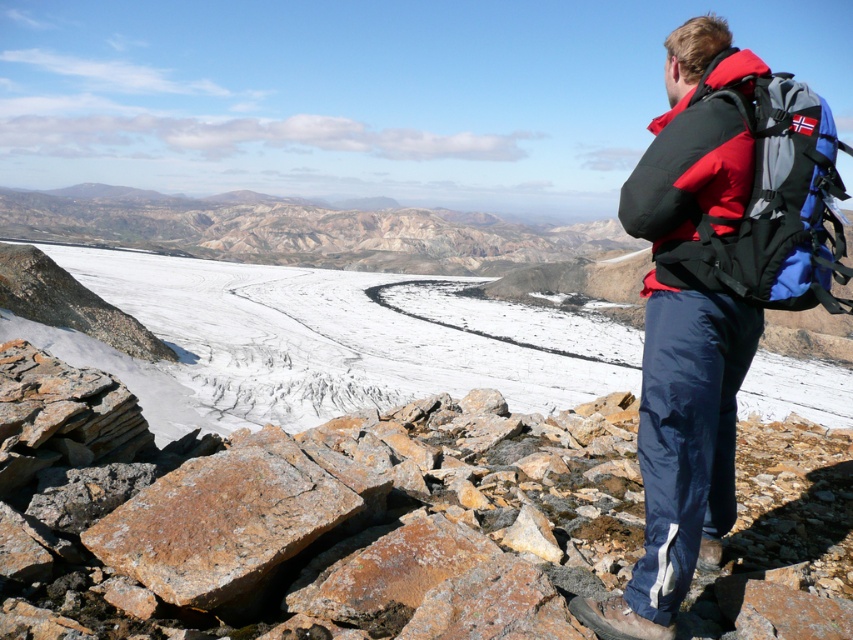
Measure the distance between rusty rock at lower left and camera.

They are 4.25 meters apart.

Is rusty rock at lower left shorter than matte black jacket at center?

Yes.

Is point (283, 561) farther from viewer compared to point (737, 188)?

Yes, it is.

The height and width of the screenshot is (640, 853). Find the location of `rusty rock at lower left`. rusty rock at lower left is located at coordinates (310, 520).

From the picture: Does rusty rock at lower left appear on the right side of blue fabric backpack at right?

In fact, rusty rock at lower left is to the left of blue fabric backpack at right.

At what (x,y) coordinates should I click in order to perform the action: click on rusty rock at lower left. Please return your answer as a coordinate pair (x, y). This screenshot has width=853, height=640. Looking at the image, I should click on 310,520.

This screenshot has height=640, width=853. What do you see at coordinates (310, 520) in the screenshot?
I see `rusty rock at lower left` at bounding box center [310, 520].

The image size is (853, 640). What are the coordinates of `rusty rock at lower left` in the screenshot? It's located at (310, 520).

Is matte black jacket at center shorter than blue fabric backpack at right?

No, matte black jacket at center is not shorter than blue fabric backpack at right.

Can you confirm if matte black jacket at center is smaller than blue fabric backpack at right?

Indeed, matte black jacket at center has a smaller size compared to blue fabric backpack at right.

Which is in front, point (691, 538) or point (764, 92)?

Point (691, 538) is more forward.

I want to click on matte black jacket at center, so click(x=688, y=324).